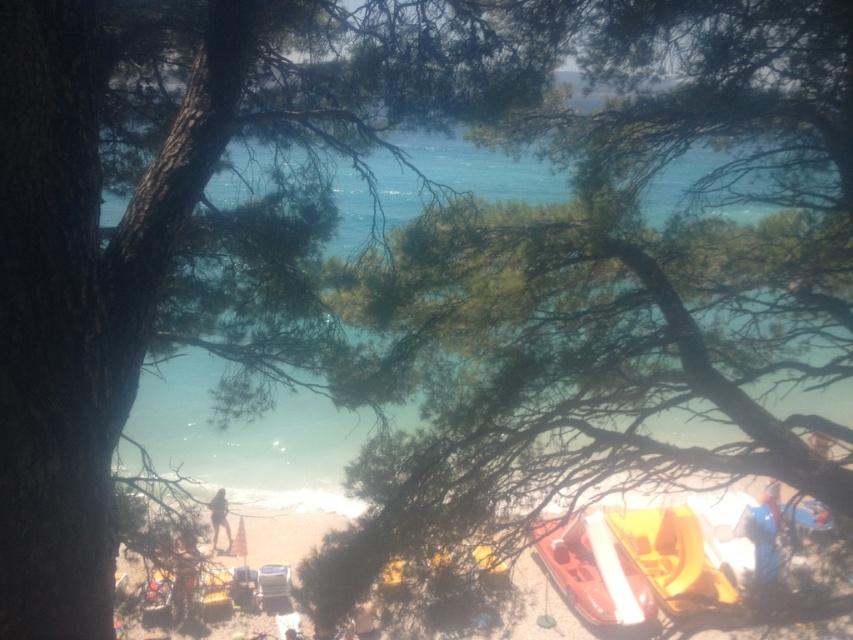
Does matte orange kayak at lower center appear on the left side of orange fabric person at lower center?

In fact, matte orange kayak at lower center is to the right of orange fabric person at lower center.

Does matte orange kayak at lower center appear over orange fabric person at lower center?

Yes, matte orange kayak at lower center is above orange fabric person at lower center.

What do you see at coordinates (595, 572) in the screenshot? The image size is (853, 640). I see `matte orange kayak at lower center` at bounding box center [595, 572].

You are a GUI agent. You are given a task and a screenshot of the screen. Output one action in this format:
    pyautogui.click(x=<x>, y=<y>)
    Task: Click on the matte orange kayak at lower center
    The width and height of the screenshot is (853, 640).
    Given the screenshot: What is the action you would take?
    pyautogui.click(x=595, y=572)

Where is `yellow plastic boat at lower right`? This screenshot has height=640, width=853. yellow plastic boat at lower right is located at coordinates (672, 557).

Can you confirm if yellow plastic boat at lower right is smaller than light brown sand at lower center?

No, yellow plastic boat at lower right is not smaller than light brown sand at lower center.

At what (x,y) coordinates should I click in order to perform the action: click on yellow plastic boat at lower right. Please return your answer as a coordinate pair (x, y). Looking at the image, I should click on (672, 557).

Is point (679, 550) positioned in front of point (180, 577)?

No, (679, 550) is behind (180, 577).

Does yellow plastic boat at lower right appear on the right side of orange fabric person at lower center?

Correct, you'll find yellow plastic boat at lower right to the right of orange fabric person at lower center.

Locate an element on the screen. The height and width of the screenshot is (640, 853). yellow plastic boat at lower right is located at coordinates 672,557.

This screenshot has width=853, height=640. Find the location of `yellow plastic boat at lower right`. yellow plastic boat at lower right is located at coordinates (672, 557).